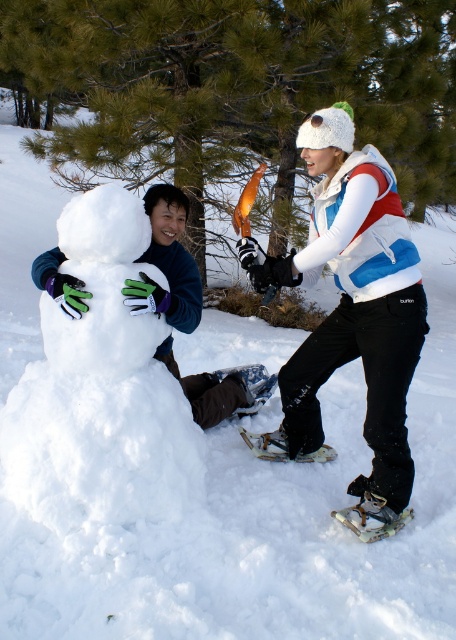
Question: Which point is farther from the camera taking this photo?

Choices:
 (A) (19, 449)
 (B) (378, 332)
 (C) (367, 512)

Answer: (C)

Question: Among these points, which one is nearest to the camera?

Choices:
 (A) (234, 376)
 (B) (382, 161)
 (C) (265, 433)
 (D) (363, 509)

Answer: (B)

Question: Is white rubber snowshoe at lower center above white plastic snowshoe at lower center?

Choices:
 (A) yes
 (B) no

Answer: (A)

Question: Considering the relative positions of white fluffy snowman at left and metallic silver snowshoe at lower right in the image provided, where is white fluffy snowman at left located with respect to metallic silver snowshoe at lower right?

Choices:
 (A) below
 (B) above

Answer: (B)

Question: Is white rubber snowshoe at lower center to the right of white plastic snowshoe at lower center from the viewer's perspective?

Choices:
 (A) yes
 (B) no

Answer: (B)

Question: Among these points, which one is nearest to the camera?

Choices:
 (A) (423, 292)
 (B) (359, 513)
 (C) (284, 435)

Answer: (B)